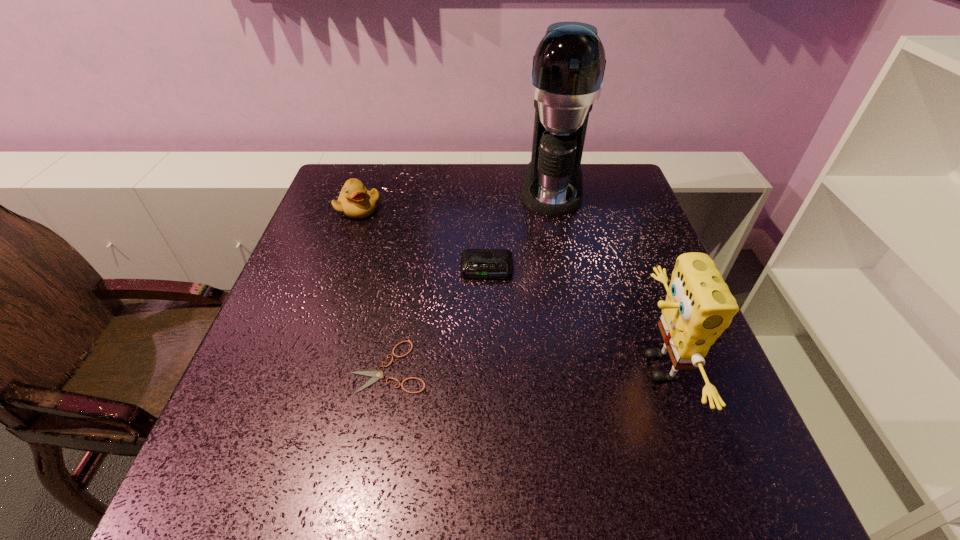
Where is `vacant space at the far edge`? The width and height of the screenshot is (960, 540). vacant space at the far edge is located at coordinates (467, 183).

You are a GUI agent. You are given a task and a screenshot of the screen. Output one action in this format:
    pyautogui.click(x=<x>, y=<y>)
    Task: Click on the vacant space at the near edge
    This screenshot has height=540, width=960.
    Given the screenshot: What is the action you would take?
    pyautogui.click(x=588, y=404)

Where is `vacant space at the left edge`? The width and height of the screenshot is (960, 540). vacant space at the left edge is located at coordinates (245, 376).

The image size is (960, 540). In the image, there is a desktop. In order to click on vacant space at the right edge in this screenshot , I will do `click(599, 258)`.

Find the location of a particular element. This screenshot has width=960, height=540. vacant region at the far left corner of the desktop is located at coordinates (358, 173).

In the image, there is a desktop. Identify the location of vacant space at the far right corner. (591, 196).

This screenshot has width=960, height=540. What are the coordinates of `empty space that is in between the coffee maker and the third nearest object` in the screenshot? It's located at (519, 228).

Find the location of a particular element. The width and height of the screenshot is (960, 540). vacant region between the coffee maker and the third tallest object is located at coordinates (455, 198).

The height and width of the screenshot is (540, 960). I want to click on free spot between the second shortest object and the sponge, so click(x=572, y=318).

Locate an element on the screen. The image size is (960, 540). free space between the leftmost object and the shortest object is located at coordinates (374, 288).